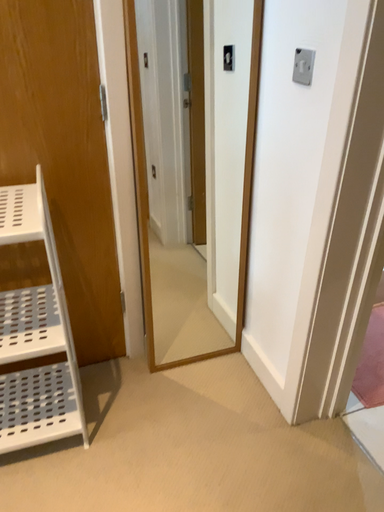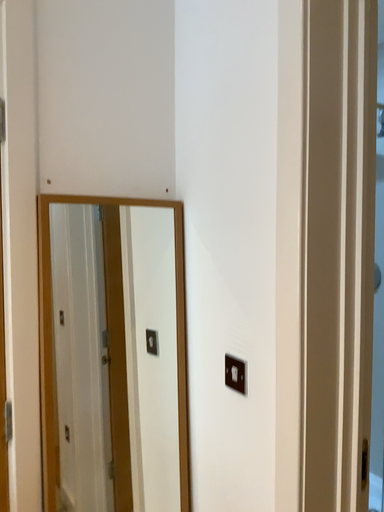
Question: Which way did the camera rotate in the video?

Choices:
 (A) rotated downward
 (B) rotated upward

Answer: (B)